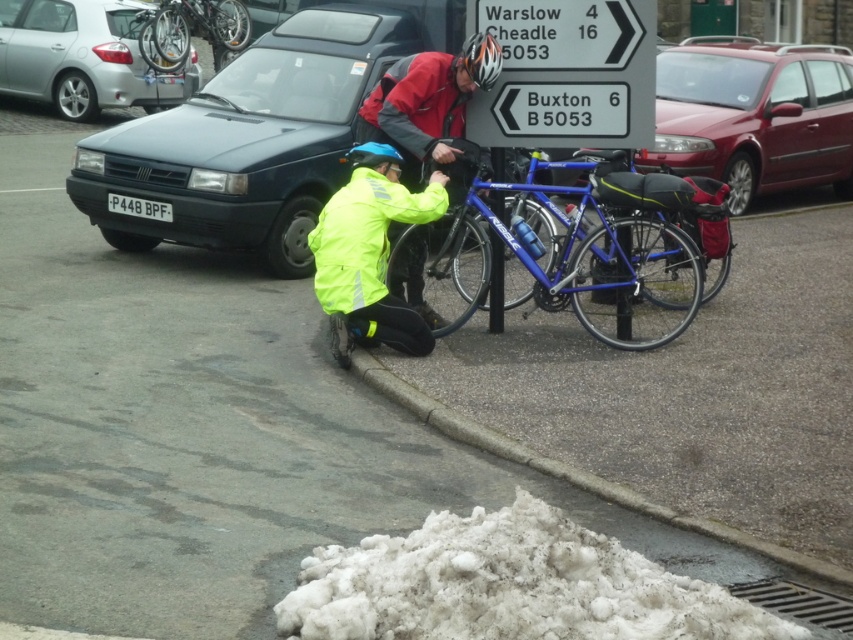
Question: Which point is closer to the camera?

Choices:
 (A) neon yellow jacket at lower center
 (B) white plastic sign at upper center

Answer: (A)

Question: Is matte black car at left smaller than metallic red car at right?

Choices:
 (A) yes
 (B) no

Answer: (A)

Question: Can you confirm if blue metallic bicycle at center is wider than silver metallic car at upper left?

Choices:
 (A) yes
 (B) no

Answer: (B)

Question: Does white plastic sign at upper center have a larger size compared to silver metallic car at upper left?

Choices:
 (A) no
 (B) yes

Answer: (A)

Question: Which of these objects is positioned closest to the neon yellow jacket at lower center?

Choices:
 (A) white plastic sign at upper center
 (B) blue metallic bicycle at center
 (C) matte black car at left

Answer: (B)

Question: Which of the following is the closest to the observer?

Choices:
 (A) [x=775, y=160]
 (B) [x=532, y=140]

Answer: (B)